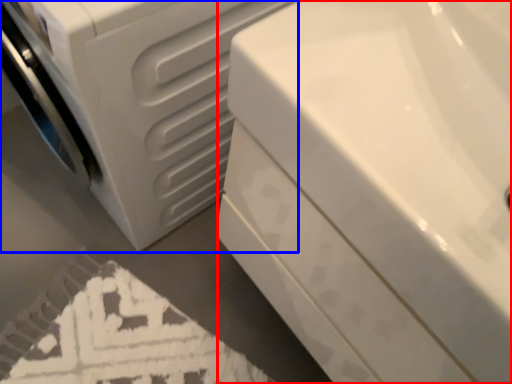
Question: Which object is closer to the camera taking this photo, bath (highlighted by a red box) or washing machine (highlighted by a blue box)?

Choices:
 (A) bath
 (B) washing machine

Answer: (A)